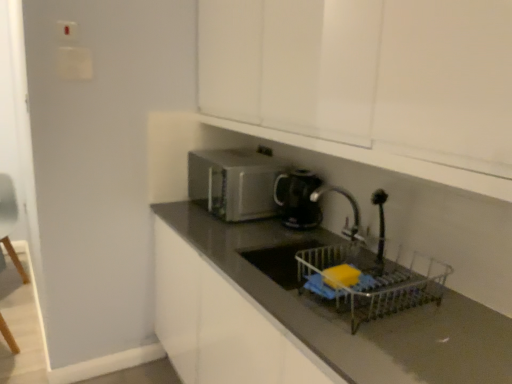
Question: Is satin silver microwave at center taller or shorter than black glossy kettle at center?

Choices:
 (A) tall
 (B) short

Answer: (A)

Question: Does point (222, 175) appear closer or farther from the camera than point (311, 218)?

Choices:
 (A) farther
 (B) closer

Answer: (B)

Question: Considering the real-world distances, which object is closest to the metallic silver dish rack at lower center?

Choices:
 (A) satin silver microwave at center
 (B) white glossy cabinet at upper center
 (C) black glossy countertop at center
 (D) black glossy kettle at center
 (E) light blue fabric armchair at left

Answer: (C)

Question: Estimate the real-world distances between objects in this image. Which object is farther from the light blue fabric armchair at left?

Choices:
 (A) satin silver microwave at center
 (B) white glossy cabinet at upper center
 (C) black glossy countertop at center
 (D) black glossy kettle at center
 (E) metallic silver dish rack at lower center

Answer: (E)